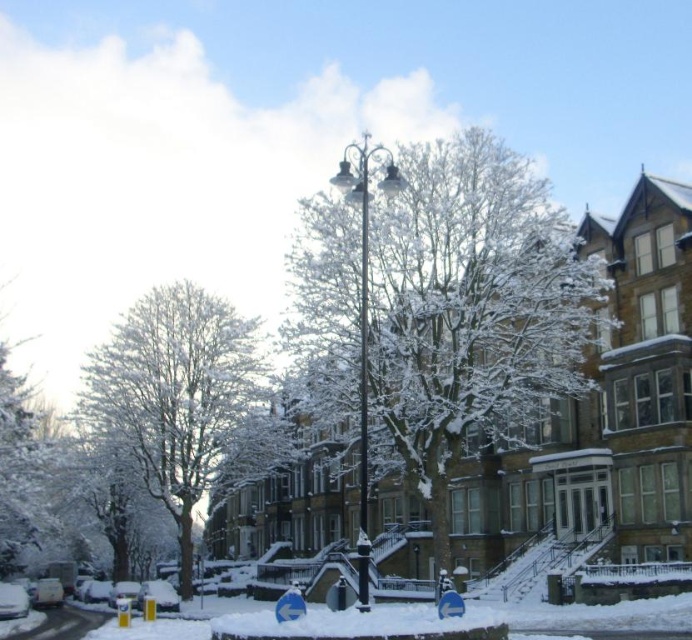
Is white snow-covered tree at center wider than metallic silver pole at center?

Indeed, white snow-covered tree at center has a greater width compared to metallic silver pole at center.

Can you confirm if white snow-covered tree at center is bigger than metallic silver pole at center?

Indeed, white snow-covered tree at center has a larger size compared to metallic silver pole at center.

Locate an element on the screen. This screenshot has height=640, width=692. white snow-covered tree at center is located at coordinates 179,400.

Find the location of a particular element. Image resolution: width=692 pixels, height=640 pixels. white snow-covered tree at center is located at coordinates (179, 400).

Is snow-covered tree at center shorter than black metal streetlight at center?

No, snow-covered tree at center is not shorter than black metal streetlight at center.

Is point (381, 193) positioned behind point (367, 157)?

That is False.

The image size is (692, 640). Identify the location of snow-covered tree at center. (468, 314).

Can you confirm if white snow-covered tree at center is thinner than white snow-covered tree at left?

No.

Which is more to the right, white snow-covered tree at center or white snow-covered tree at left?

From the viewer's perspective, white snow-covered tree at center appears more on the right side.

Identify the location of white snow-covered tree at center. The image size is (692, 640). (179, 400).